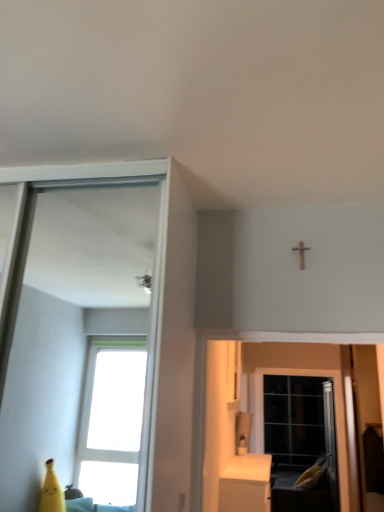
Question: Is black glass screen door at lower right inside or outside of white glossy cabinet at lower right?

Choices:
 (A) inside
 (B) outside

Answer: (B)

Question: Is point (253, 426) positioned closer to the camera than point (244, 507)?

Choices:
 (A) closer
 (B) farther

Answer: (B)

Question: From the image's perspective, is black glass screen door at lower right located above or below white glossy cabinet at lower right?

Choices:
 (A) above
 (B) below

Answer: (B)

Question: Considering the positions of white glossy cabinet at lower right and black glass screen door at lower right in the image, is white glossy cabinet at lower right taller or shorter than black glass screen door at lower right?

Choices:
 (A) short
 (B) tall

Answer: (A)

Question: Based on their positions, is white glossy cabinet at lower right located to the left or right of black glass screen door at lower right?

Choices:
 (A) left
 (B) right

Answer: (A)

Question: Which is correct: white glossy cabinet at lower right is inside black glass screen door at lower right, or outside of it?

Choices:
 (A) outside
 (B) inside

Answer: (A)

Question: From the image's perspective, is white glossy cabinet at lower right located above or below black glass screen door at lower right?

Choices:
 (A) above
 (B) below

Answer: (A)